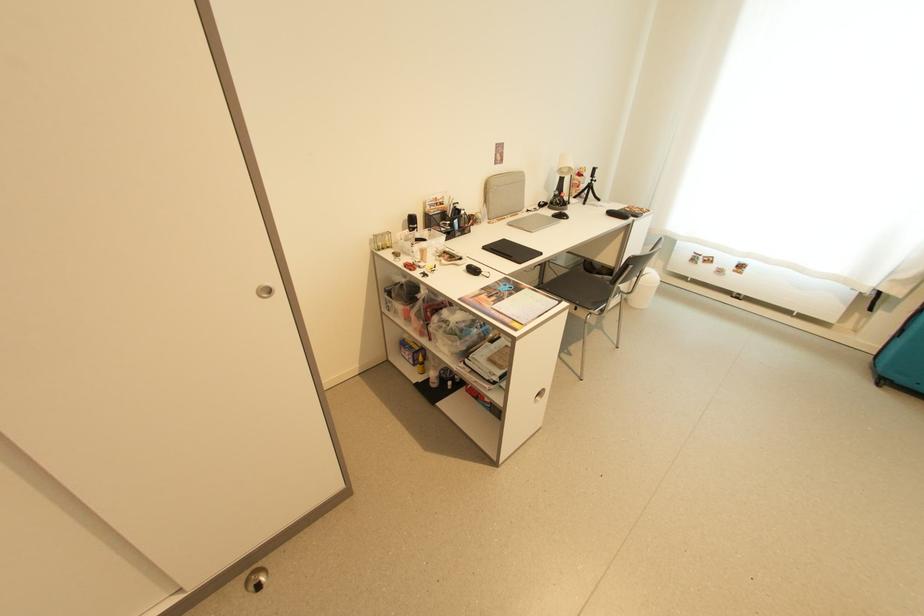
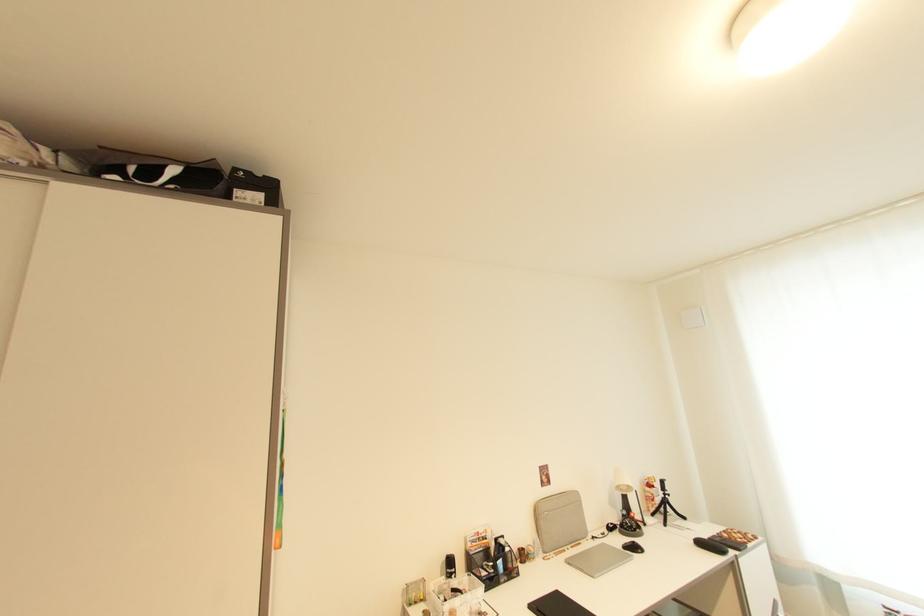
Find the pixel in the second image that matches pixel 570 172 in the first image.

(629, 490)